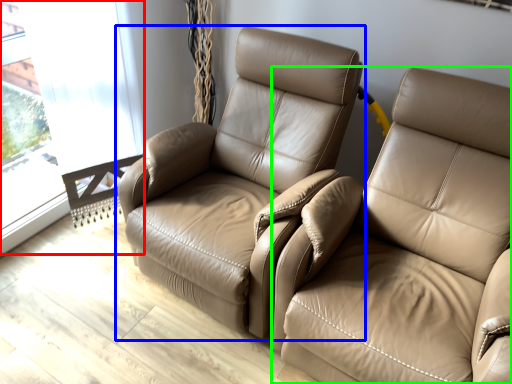
Question: Estimate the real-world distances between objects in this image. Which object is farther from window (highlighted by a red box), chair (highlighted by a blue box) or studio couch (highlighted by a green box)?

Choices:
 (A) chair
 (B) studio couch

Answer: (B)